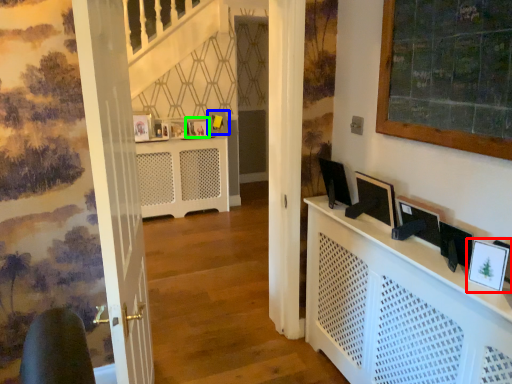
Question: Considering the real-world distances, which object is farthest from picture frame (highlighted by a red box)? picture frame (highlighted by a blue box) or picture frame (highlighted by a green box)?

Choices:
 (A) picture frame
 (B) picture frame

Answer: (A)